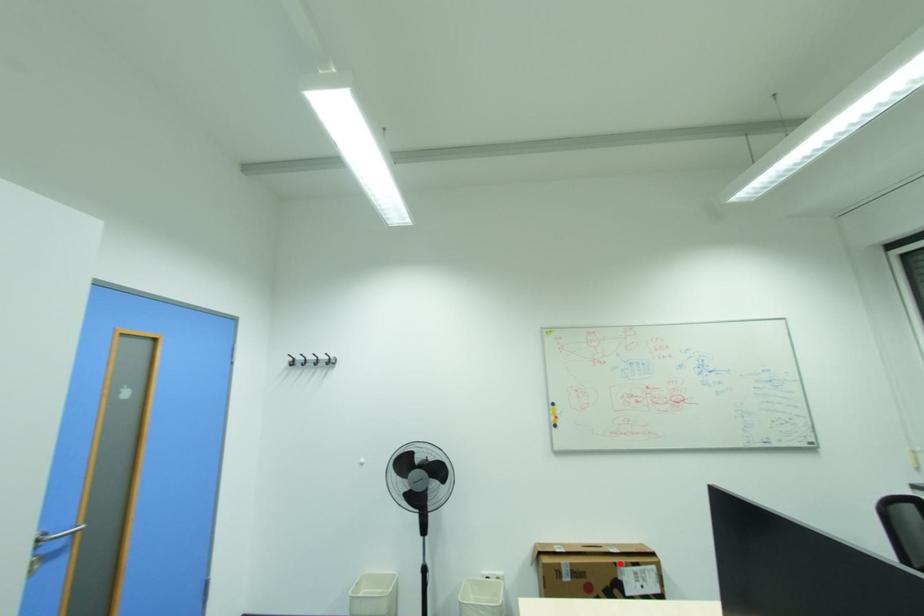
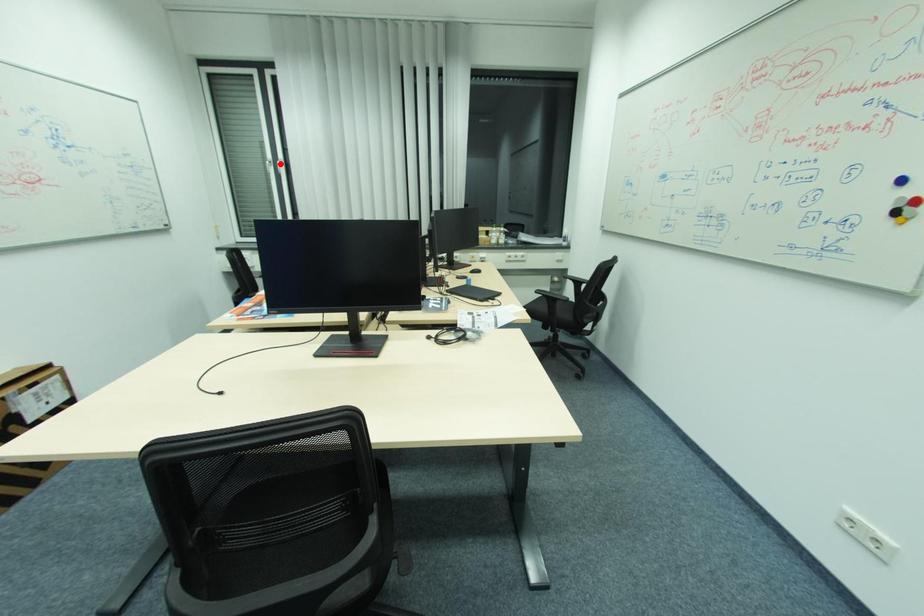
I am providing you with two images of the same scene from different viewpoints. A red point is marked on the first image and another point is marked on the second image. Does the point marked in image1 correspond to the same location as the one in image2?

No